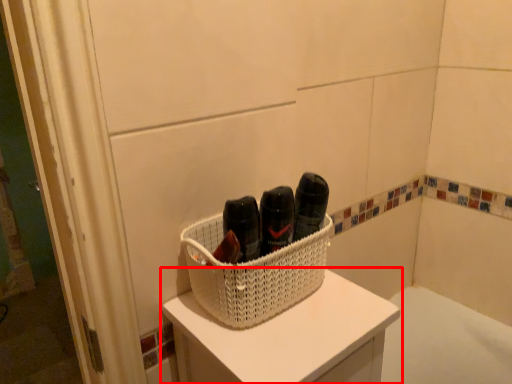
Question: Observing the image, what is the correct spatial positioning of furniture (annotated by the red box) in reference to basket?

Choices:
 (A) left
 (B) right

Answer: (B)